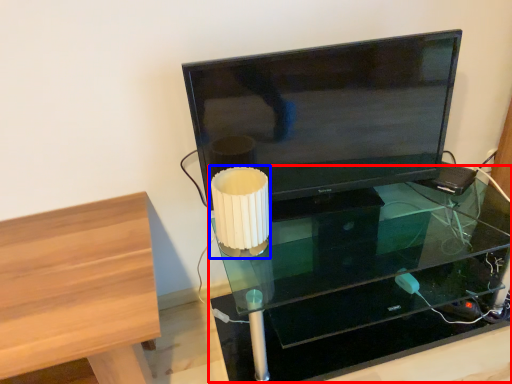
Question: Which point is closer to the camera, table (highlighted by a red box) or table lamp (highlighted by a blue box)?

Choices:
 (A) table
 (B) table lamp

Answer: (A)